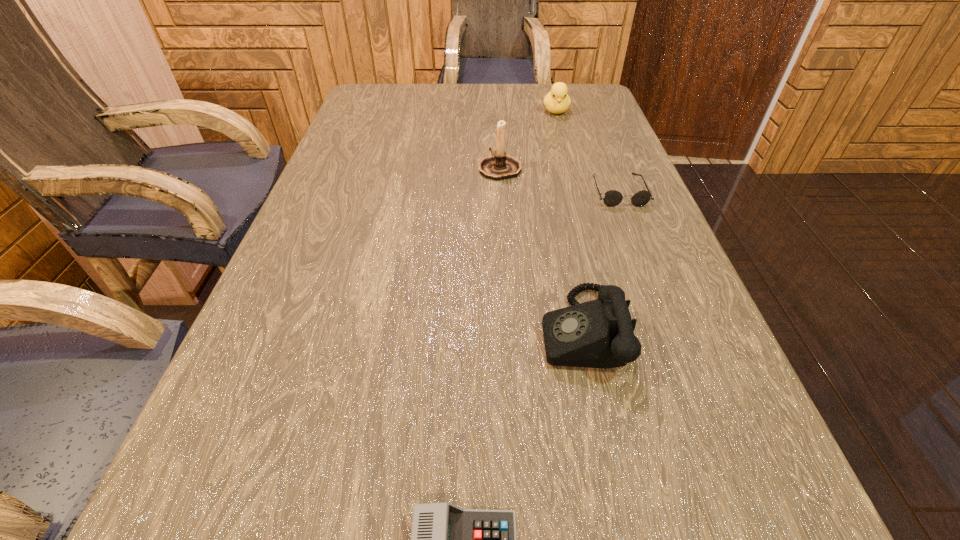
You are a GUI agent. You are given a task and a screenshot of the screen. Output one action in this format:
    pyautogui.click(x=<x>, y=<y>)
    Task: Click on the empty space that is in between the tallest object and the duck
    
    Given the screenshot: What is the action you would take?
    pyautogui.click(x=528, y=139)

You are a GUI agent. You are given a task and a screenshot of the screen. Output one action in this format:
    pyautogui.click(x=<x>, y=<y>)
    Task: Click on the vacant area that lies between the second shortest object and the duck
    
    Given the screenshot: What is the action you would take?
    pyautogui.click(x=588, y=151)

You are a GUI agent. You are given a task and a screenshot of the screen. Output one action in this format:
    pyautogui.click(x=<x>, y=<y>)
    Task: Click on the free space that is in between the farthest object and the fourth farthest object
    The height and width of the screenshot is (540, 960).
    Given the screenshot: What is the action you would take?
    pyautogui.click(x=568, y=221)

What are the coordinates of `blank region between the duck and the telephone` in the screenshot? It's located at (568, 221).

The height and width of the screenshot is (540, 960). I want to click on the third closest object to the candle holder, so click(600, 333).

Select which object is the second closest to the nearest object. Please provide its 2D coordinates. Your answer should be formatted as a tuple, i.e. [(x, y)], where the tuple contains the x and y coordinates of a point satisfying the conditions above.

[(612, 198)]

You are a GUI agent. You are given a task and a screenshot of the screen. Output one action in this format:
    pyautogui.click(x=<x>, y=<y>)
    Task: Click on the free space that satisfies the following two spatial constraints: 1. on the front-facing side of the sunglasses; 2. on the dial of the telephone
    
    Given the screenshot: What is the action you would take?
    pyautogui.click(x=673, y=330)